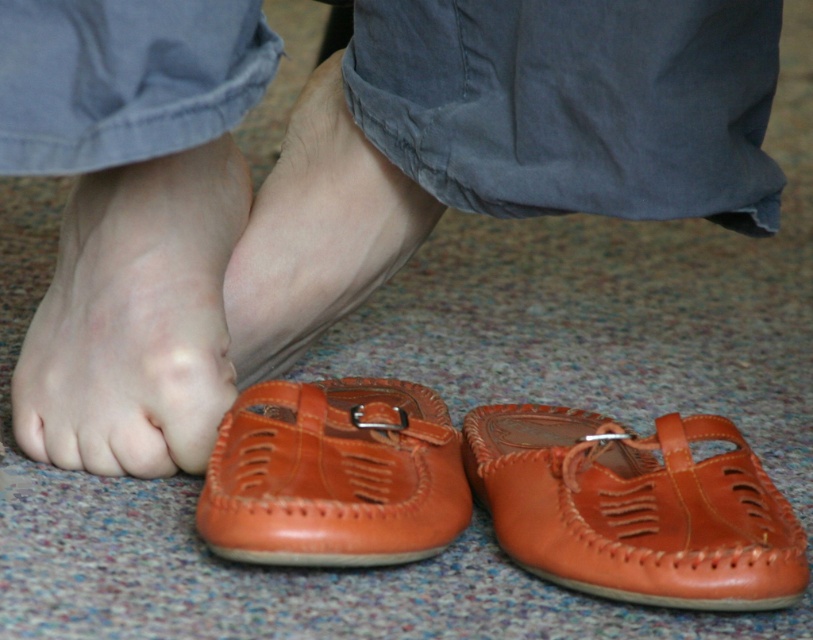
You are a person whose feet are currently bare. You want to put on the brown leather shoe at lower right located at point [635,508]. Which direction should you move your feet to reach it?

The brown leather shoe at lower right is located at point [635,508], so you should move your feet downward to reach it.

You are a photographer setting up a shoot and need to position a small prop between the matte orange leather foot at lower left and the brown leather shoe at lower center. Based on their positions, which object should the prop be closer to?

The matte orange leather foot at lower left is closer to the viewer than the brown leather shoe at lower center, so the prop should be placed closer to the matte orange leather foot at lower left to maintain visual balance.

You are a photographer setting up a shoot and need to position a camera to capture both the leather shoes at lower center and the brown leather shoe at lower right. Which shoe should you focus on first to ensure both are in frame?

You should focus on the leather shoes at lower center first because it is closer to the viewer than the brown leather shoe at lower right, so adjusting the camera to include both would require starting with the closer object.